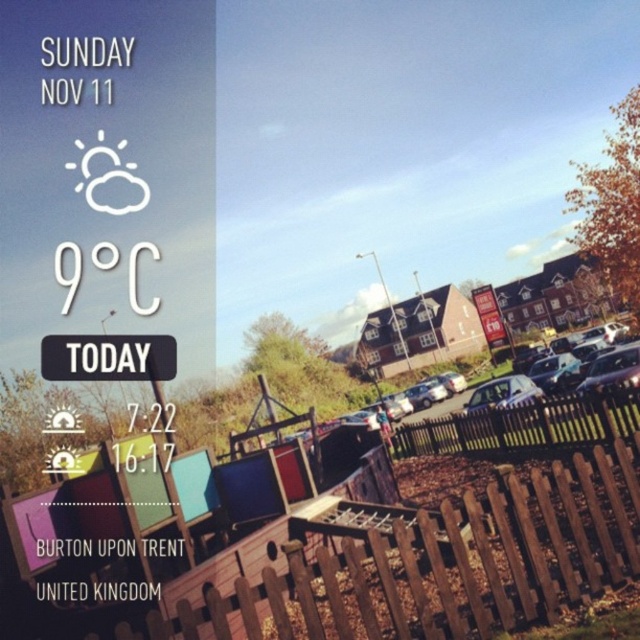
Question: Which is nearer to the brown wooden fence at center?

Choices:
 (A) brown wooden fence at lower right
 (B) black plastic sign at center
 (C) satin silver car at center

Answer: (C)

Question: Which of the following is the closest to the observer?

Choices:
 (A) brown wooden fence at center
 (B) brown wooden fence at lower right

Answer: (B)

Question: Observing the image, what is the correct spatial positioning of black plastic sign at center in reference to satin silver car at center?

Choices:
 (A) below
 (B) above

Answer: (B)

Question: Among these points, which one is nearest to the camera?

Choices:
 (A) (96, 349)
 (B) (316, 618)
 (C) (518, 401)

Answer: (B)

Question: Where is brown wooden fence at lower right located in relation to black plastic sign at center in the image?

Choices:
 (A) left
 (B) right

Answer: (B)

Question: Can you confirm if brown wooden fence at lower right is bigger than satin silver car at center?

Choices:
 (A) no
 (B) yes

Answer: (A)